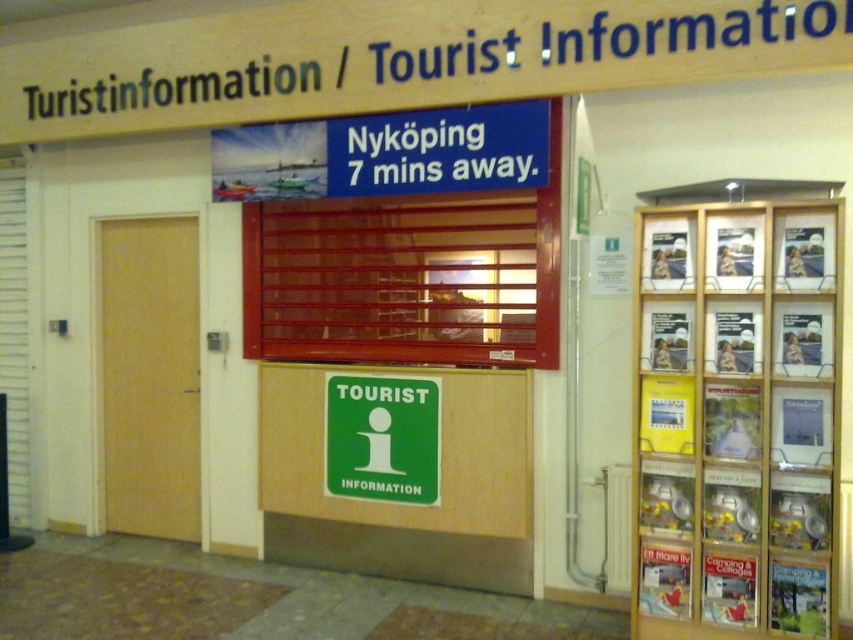
Does wooden door at left appear on the right side of green matte sign at center?

No, wooden door at left is not to the right of green matte sign at center.

Who is shorter, wooden door at left or green matte sign at center?

green matte sign at center

Which is in front, point (144, 333) or point (426, 426)?

Point (426, 426) is in front.

Find the location of a particular element. This screenshot has height=640, width=853. wooden door at left is located at coordinates (149, 376).

Which of these two, wooden frame brochure rack at right or wooden door at left, stands taller?

With more height is wooden door at left.

Is point (692, 240) farther from camera compared to point (138, 396)?

No, it is not.

At what (x,y) coordinates should I click in order to perform the action: click on wooden frame brochure rack at right. Please return your answer as a coordinate pair (x, y). Image resolution: width=853 pixels, height=640 pixels. Looking at the image, I should click on (735, 420).

Find the location of `wooden frame brochure rack at right`. wooden frame brochure rack at right is located at coordinates (735, 420).

Find the location of a particular element. The width and height of the screenshot is (853, 640). wooden frame brochure rack at right is located at coordinates (735, 420).

Does wooden frame brochure rack at right have a larger size compared to green matte sign at center?

Yes, wooden frame brochure rack at right is bigger than green matte sign at center.

Find the location of a particular element. Image resolution: width=853 pixels, height=640 pixels. wooden frame brochure rack at right is located at coordinates (735, 420).